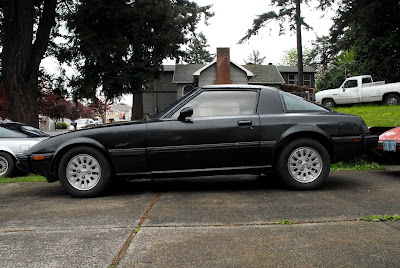
At what (x,y) coordinates should I click in order to perform the action: click on window. Please return your answer as a coordinate pair (x, y). Looking at the image, I should click on (186, 89), (290, 77), (308, 80).